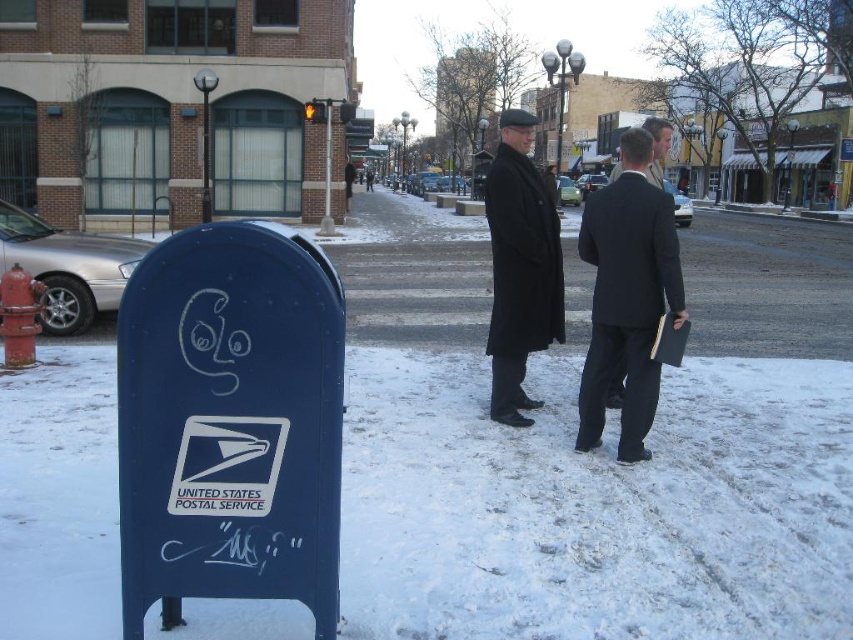
Who is lower down, black matte suit at center or black wool coat at center?

black matte suit at center

Is point (590, 316) positioned behind point (541, 179)?

Yes, it is behind point (541, 179).

Who is more distant from viewer, (643, 196) or (495, 412)?

Point (495, 412)

Find the location of `black matte suit at center`. black matte suit at center is located at coordinates (627, 296).

This screenshot has height=640, width=853. Describe the element at coordinates (230, 422) in the screenshot. I see `blue painted metal mailbox at lower left` at that location.

Looking at this image, does blue painted metal mailbox at lower left appear under black wool coat at center?

Correct, blue painted metal mailbox at lower left is located below black wool coat at center.

Image resolution: width=853 pixels, height=640 pixels. Identify the location of blue painted metal mailbox at lower left. pos(230,422).

This screenshot has width=853, height=640. Find the location of `blue painted metal mailbox at lower left`. blue painted metal mailbox at lower left is located at coordinates (230, 422).

From the picture: Between blue painted metal mailbox at lower left and black matte suit at center, which one has less height?

blue painted metal mailbox at lower left is shorter.

Is point (235, 241) behind point (613, 336)?

That is False.

Which is behind, point (271, 424) or point (635, 168)?

Positioned behind is point (635, 168).

At what (x,y) coordinates should I click in order to perform the action: click on blue painted metal mailbox at lower left. Please return your answer as a coordinate pair (x, y). Image resolution: width=853 pixels, height=640 pixels. Looking at the image, I should click on (230, 422).